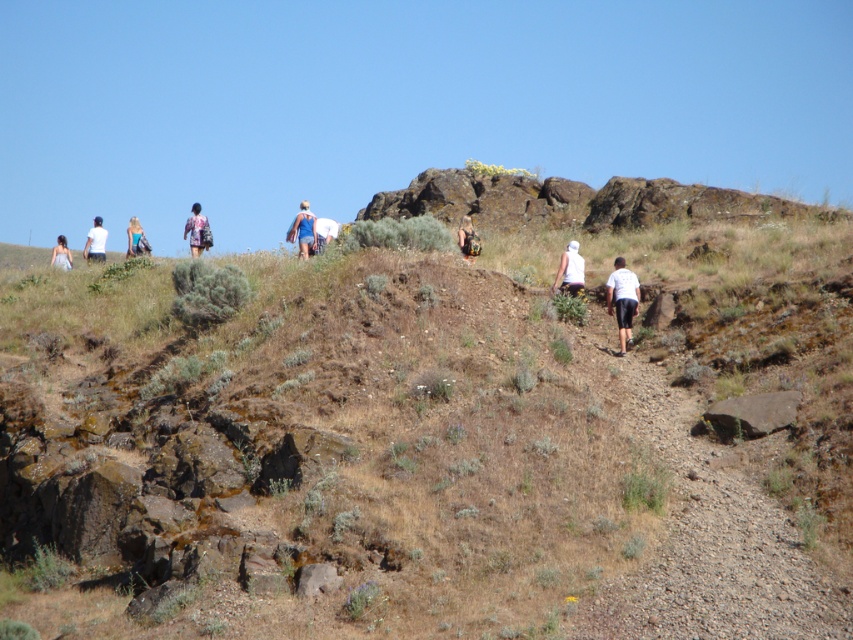
Identify the location of white matte shirt at center. This screenshot has height=640, width=853. (570, 269).

This screenshot has height=640, width=853. What do you see at coordinates (570, 269) in the screenshot?
I see `white matte shirt at center` at bounding box center [570, 269].

Which is in front, point (553, 285) or point (94, 220)?

Point (553, 285)

This screenshot has height=640, width=853. I want to click on white matte shirt at center, so click(x=570, y=269).

What do you see at coordinates (195, 230) in the screenshot? I see `matte purple backpack at center` at bounding box center [195, 230].

Between point (189, 244) and point (138, 230), which one is positioned in front?

Point (189, 244) is in front.

Locate an element on the screen. This screenshot has height=640, width=853. matte purple backpack at center is located at coordinates (195, 230).

Is point (624, 292) less distant than point (190, 253)?

Yes, point (624, 292) is closer to viewer.

Which is more to the right, white matte shirt at lower right or matte purple backpack at center?

From the viewer's perspective, white matte shirt at lower right appears more on the right side.

Who is more forward, (608,285) or (195,237)?

Positioned in front is point (608,285).

This screenshot has width=853, height=640. Find the location of `white matte shirt at lower right`. white matte shirt at lower right is located at coordinates (622, 301).